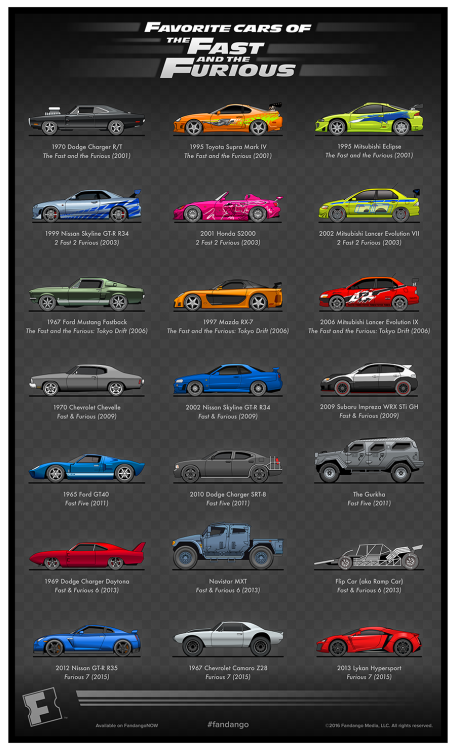
Identify the location of poster. (228, 74).